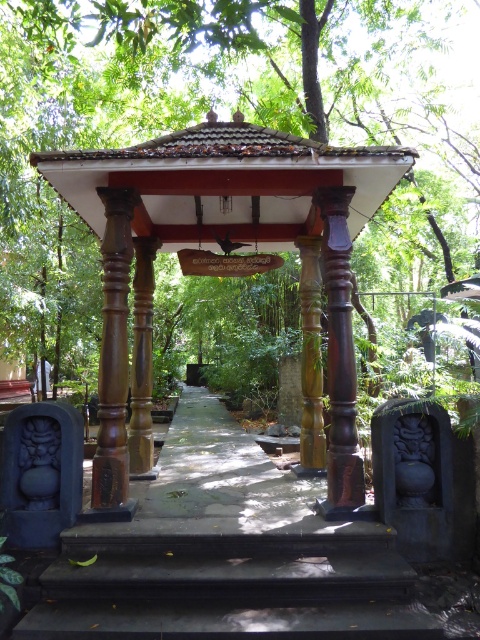
From the picture: You are standing at the entrance of the garden and want to walk towards the brown polished wood gazebo at center and the black stone stairs at center. Which object will you encounter first?

The brown polished wood gazebo at center is closer to you than the black stone stairs at center, so you will encounter the brown polished wood gazebo at center first.